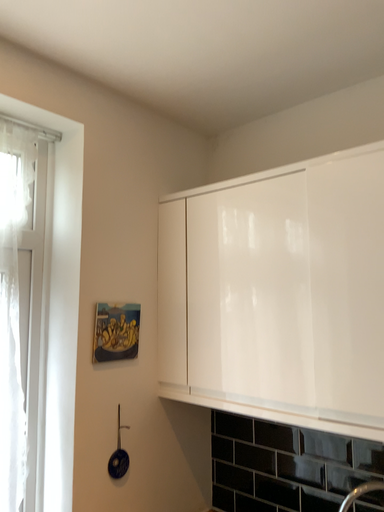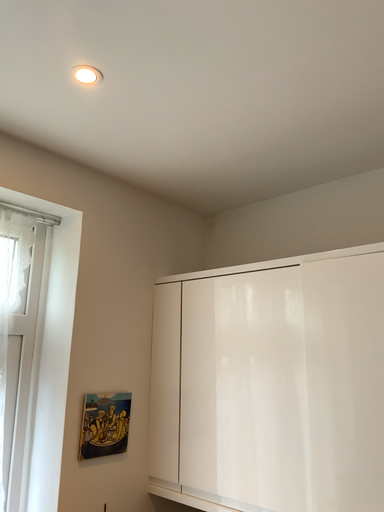
Question: How did the camera likely rotate when shooting the video?

Choices:
 (A) rotated upward
 (B) rotated downward

Answer: (A)